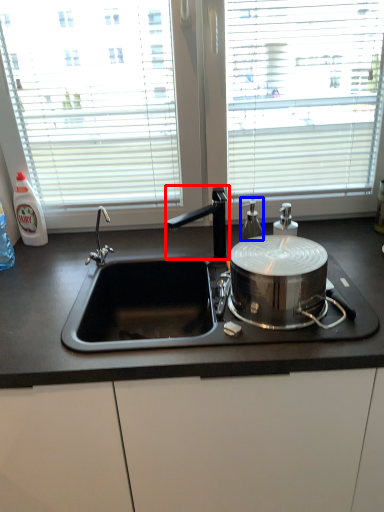
Question: Which of the following is the closest to the observer, tap (highlighted by a red box) or bottle (highlighted by a blue box)?

Choices:
 (A) tap
 (B) bottle

Answer: (A)